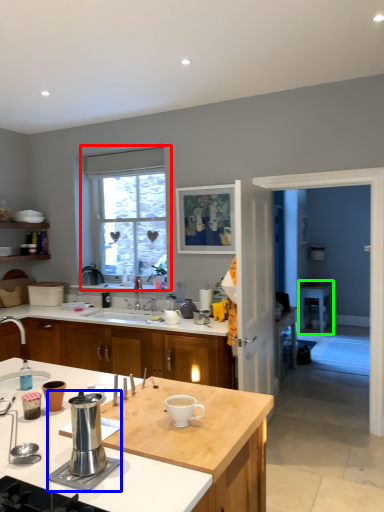
Question: Based on their relative distances, which object is farther from window (highlighted by a red box)? Choose from appliance (highlighted by a blue box) and desk (highlighted by a green box).

Choices:
 (A) appliance
 (B) desk

Answer: (A)